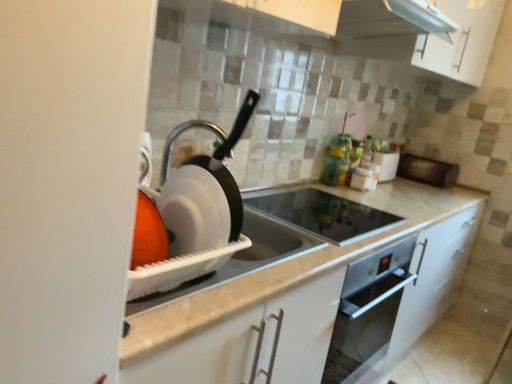
Question: Is black glass cooktop at center, the second appliance when ordered from left to right, smaller than white glossy toaster at upper right, the second appliance when ordered from right to left?

Choices:
 (A) no
 (B) yes

Answer: (A)

Question: Is black glass cooktop at center, acting as the third appliance starting from the right, bigger than white glossy toaster at upper right, the 2th appliance viewed from the back?

Choices:
 (A) yes
 (B) no

Answer: (A)

Question: From the image's perspective, is black glass cooktop at center, which appears as the 3th appliance when viewed from the back, under white glossy toaster at upper right, the 3th appliance in the left-to-right sequence?

Choices:
 (A) no
 (B) yes

Answer: (B)

Question: Is there a large distance between black glass cooktop at center, acting as the third appliance starting from the right, and white glossy toaster at upper right, which ranks as the 3th appliance in front-to-back order?

Choices:
 (A) no
 (B) yes

Answer: (A)

Question: Is black glass cooktop at center, the second appliance from the front, shorter than white glossy toaster at upper right, the second appliance when ordered from right to left?

Choices:
 (A) yes
 (B) no

Answer: (A)

Question: Considering the relative positions of black glass cooktop at center, the second appliance when ordered from left to right, and white glossy toaster at upper right, the 3th appliance in the left-to-right sequence, in the image provided, is black glass cooktop at center, the second appliance when ordered from left to right, to the left of white glossy toaster at upper right, the 3th appliance in the left-to-right sequence, from the viewer's perspective?

Choices:
 (A) no
 (B) yes

Answer: (B)

Question: From a real-world perspective, is white glossy toaster at upper right, the 2th appliance viewed from the back, below black glass cooktop at center, the second appliance when ordered from left to right?

Choices:
 (A) no
 (B) yes

Answer: (A)

Question: Considering the relative sizes of white glossy toaster at upper right, the 3th appliance in the left-to-right sequence, and black glass cooktop at center, the second appliance when ordered from left to right, in the image provided, is white glossy toaster at upper right, the 3th appliance in the left-to-right sequence, thinner than black glass cooktop at center, the second appliance when ordered from left to right,?

Choices:
 (A) no
 (B) yes

Answer: (B)

Question: Is white glossy toaster at upper right, the 2th appliance viewed from the back, not inside black glass cooktop at center, which appears as the 3th appliance when viewed from the back?

Choices:
 (A) no
 (B) yes

Answer: (B)

Question: Is white glossy toaster at upper right, which ranks as the 3th appliance in front-to-back order, far from black glass cooktop at center, the second appliance from the front?

Choices:
 (A) yes
 (B) no

Answer: (B)

Question: Is white glossy toaster at upper right, which ranks as the 3th appliance in front-to-back order, surrounding black glass cooktop at center, acting as the third appliance starting from the right?

Choices:
 (A) yes
 (B) no

Answer: (B)

Question: From the image's perspective, is white glossy toaster at upper right, which ranks as the 3th appliance in front-to-back order, over black glass cooktop at center, the second appliance when ordered from left to right?

Choices:
 (A) no
 (B) yes

Answer: (B)

Question: Does black matte microwave at right, the 1th appliance from the back, have a lesser height compared to white glossy exhaust hood at upper center?

Choices:
 (A) yes
 (B) no

Answer: (A)